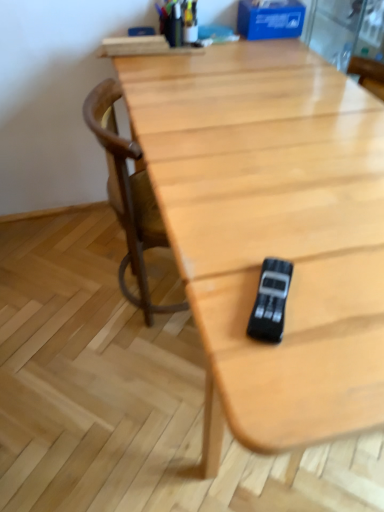
Question: Considering the relative positions of black plastic game controller at center and wooden chair at center in the image provided, is black plastic game controller at center in front of wooden chair at center?

Choices:
 (A) yes
 (B) no

Answer: (A)

Question: Is black plastic game controller at center oriented away from wooden chair at center?

Choices:
 (A) yes
 (B) no

Answer: (B)

Question: Is black plastic game controller at center far from wooden chair at center?

Choices:
 (A) no
 (B) yes

Answer: (A)

Question: Is black plastic game controller at center to the right of wooden chair at center from the viewer's perspective?

Choices:
 (A) yes
 (B) no

Answer: (A)

Question: Considering the relative positions of black plastic game controller at center and wooden chair at center in the image provided, is black plastic game controller at center to the left of wooden chair at center from the viewer's perspective?

Choices:
 (A) yes
 (B) no

Answer: (B)

Question: From a real-world perspective, is black plastic game controller at center physically above wooden chair at center?

Choices:
 (A) no
 (B) yes

Answer: (B)

Question: Is black plastic game controller at center at the back of wooden chair at center?

Choices:
 (A) yes
 (B) no

Answer: (B)

Question: Is wooden chair at center not near black plastic game controller at center?

Choices:
 (A) yes
 (B) no

Answer: (B)

Question: Does wooden chair at center turn towards black plastic game controller at center?

Choices:
 (A) no
 (B) yes

Answer: (A)

Question: Considering the relative positions of wooden chair at center and black plastic game controller at center in the image provided, is wooden chair at center in front of black plastic game controller at center?

Choices:
 (A) no
 (B) yes

Answer: (A)

Question: Can you confirm if wooden chair at center is bigger than black plastic game controller at center?

Choices:
 (A) no
 (B) yes

Answer: (B)

Question: From a real-world perspective, is wooden chair at center below black plastic game controller at center?

Choices:
 (A) yes
 (B) no

Answer: (A)

Question: From a real-world perspective, is black plastic game controller at center positioned above or below wooden chair at center?

Choices:
 (A) above
 (B) below

Answer: (A)